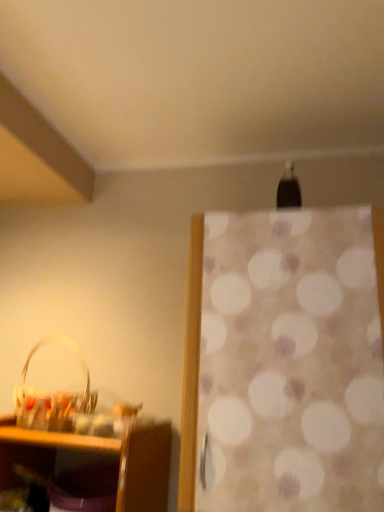
This screenshot has height=512, width=384. What do you see at coordinates (52, 396) in the screenshot? I see `translucent plastic basket at lower left` at bounding box center [52, 396].

In order to face translucent plastic basket at lower left, should I rotate leftwards or rightwards?

A 18.170 degree turn to the left will do.

Measure the distance between point (66, 346) and camera.

Point (66, 346) is 1.46 meters away from camera.

This screenshot has height=512, width=384. Find the location of `translucent plastic basket at lower left`. translucent plastic basket at lower left is located at coordinates (52, 396).

Describe the element at coordinates (291, 362) in the screenshot. I see `white dotted fabric at center` at that location.

Find the location of a particular element. white dotted fabric at center is located at coordinates (291, 362).

Where is `translucent plastic basket at lower left`? translucent plastic basket at lower left is located at coordinates (52, 396).

Is white dotted fabric at center at the right side of translucent plastic basket at lower left?

Indeed, white dotted fabric at center is positioned on the right side of translucent plastic basket at lower left.

From the picture: Relative to translucent plastic basket at lower left, is white dotted fabric at center in front or behind?

white dotted fabric at center is in front of translucent plastic basket at lower left.

Is point (201, 419) positioned behind point (88, 409)?

No, it is in front of (88, 409).

From the image's perspective, which is above, white dotted fabric at center or translucent plastic basket at lower left?

From the image's view, white dotted fabric at center is above.

From a real-world perspective, is white dotted fabric at center located beneath translucent plastic basket at lower left?

No, from a real-world perspective, white dotted fabric at center is not beneath translucent plastic basket at lower left.

Between white dotted fabric at center and translucent plastic basket at lower left, which one has larger width?

white dotted fabric at center.

Considering the relative sizes of white dotted fabric at center and translucent plastic basket at lower left in the image provided, is white dotted fabric at center taller than translucent plastic basket at lower left?

Correct, white dotted fabric at center is much taller as translucent plastic basket at lower left.

Considering the relative sizes of white dotted fabric at center and translucent plastic basket at lower left in the image provided, is white dotted fabric at center bigger than translucent plastic basket at lower left?

Indeed, white dotted fabric at center has a larger size compared to translucent plastic basket at lower left.

Is translucent plastic basket at lower left inside white dotted fabric at center?

No, white dotted fabric at center does not contain translucent plastic basket at lower left.

Is white dotted fabric at center with translucent plastic basket at lower left?

No, white dotted fabric at center is not next to translucent plastic basket at lower left.

Is white dotted fabric at center oriented away from translucent plastic basket at lower left?

No, white dotted fabric at center's orientation is not away from translucent plastic basket at lower left.

What's the angular difference between white dotted fabric at center and translucent plastic basket at lower left's facing directions?

The facing directions of white dotted fabric at center and translucent plastic basket at lower left are 2.74 degrees apart.

Measure the distance from white dotted fabric at center to translucent plastic basket at lower left.

A distance of 22.23 inches exists between white dotted fabric at center and translucent plastic basket at lower left.

The image size is (384, 512). I want to click on curtain above the translucent plastic basket at lower left (from a real-world perspective), so click(291, 362).

Does translucent plastic basket at lower left appear on the left side of white dotted fabric at center?

Yes.

Is translucent plastic basket at lower left positioned in front of white dotted fabric at center?

No, translucent plastic basket at lower left is behind white dotted fabric at center.

Which is behind, point (62, 337) or point (319, 509)?

The point (62, 337) is farther from the camera.

From the image's perspective, relative to white dotted fabric at center, is translucent plastic basket at lower left above or below?

Based on their image positions, translucent plastic basket at lower left is located beneath white dotted fabric at center.

From a real-world perspective, is translucent plastic basket at lower left physically below white dotted fabric at center?

Yes.

Considering the relative sizes of translucent plastic basket at lower left and white dotted fabric at center in the image provided, is translucent plastic basket at lower left thinner than white dotted fabric at center?

Correct, the width of translucent plastic basket at lower left is less than that of white dotted fabric at center.

Considering the sizes of objects translucent plastic basket at lower left and white dotted fabric at center in the image provided, who is taller, translucent plastic basket at lower left or white dotted fabric at center?

white dotted fabric at center.

Is translucent plastic basket at lower left bigger than white dotted fabric at center?

Incorrect, translucent plastic basket at lower left is not larger than white dotted fabric at center.

Would you say white dotted fabric at center is part of translucent plastic basket at lower left's contents?

No, translucent plastic basket at lower left does not contain white dotted fabric at center.

Are translucent plastic basket at lower left and white dotted fabric at center beside each other?

No, translucent plastic basket at lower left is not beside white dotted fabric at center.

Is translucent plastic basket at lower left oriented towards white dotted fabric at center?

No, translucent plastic basket at lower left is not facing towards white dotted fabric at center.

Where is `curtain on the right of the translucent plastic basket at lower left`? curtain on the right of the translucent plastic basket at lower left is located at coordinates [291, 362].

Where is `basket lying behind the white dotted fabric at center`? This screenshot has width=384, height=512. basket lying behind the white dotted fabric at center is located at coordinates (52, 396).

This screenshot has width=384, height=512. Find the location of `curtain above the translucent plastic basket at lower left (from the image's perspective)`. curtain above the translucent plastic basket at lower left (from the image's perspective) is located at coordinates (291, 362).